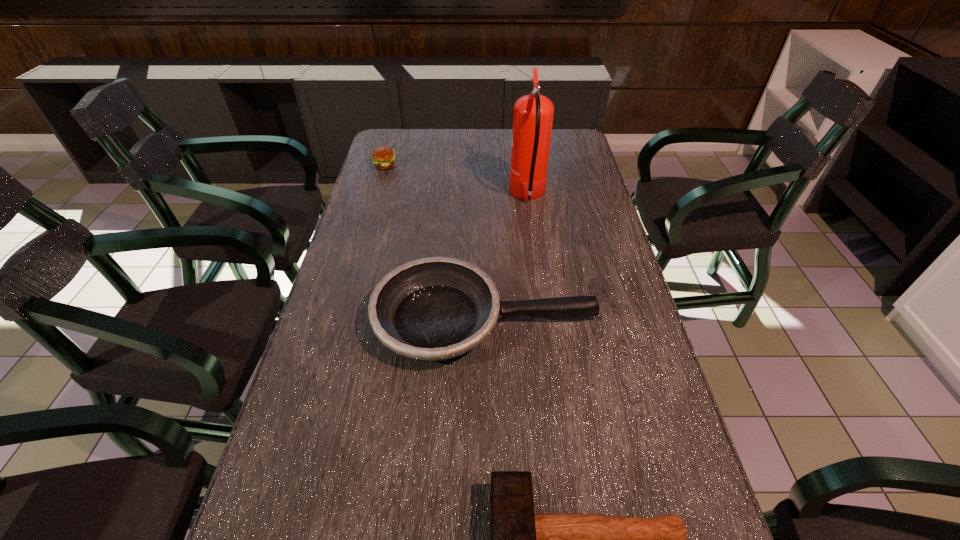
At what (x,y) coordinates should I click in order to perform the action: click on blank region between the tallest object and the frying pan. Please return your answer as a coordinate pair (x, y). Looking at the image, I should click on (507, 258).

In order to click on vacant area that lies between the frying pan and the farthest object in this screenshot , I will do `click(435, 243)`.

Image resolution: width=960 pixels, height=540 pixels. Find the location of `object that is the second nearest to the nearest object`. object that is the second nearest to the nearest object is located at coordinates (533, 114).

The image size is (960, 540). I want to click on object that ranks as the third closest to the tallest object, so click(520, 539).